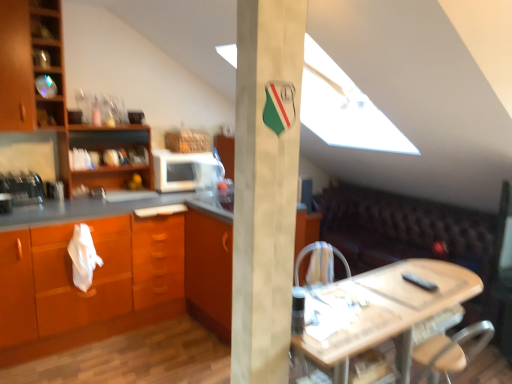
Question: From a real-world perspective, is white fabric armchair at center over metallic silver toaster at left, which is the 2th appliance in back-to-front order?

Choices:
 (A) yes
 (B) no

Answer: (B)

Question: From the image's perspective, is white fabric armchair at center over metallic silver toaster at left, arranged as the 1th appliance when viewed from the front?

Choices:
 (A) no
 (B) yes

Answer: (A)

Question: From the image's perspective, would you say white fabric armchair at center is shown under metallic silver toaster at left, arranged as the 1th appliance when viewed from the front?

Choices:
 (A) yes
 (B) no

Answer: (A)

Question: Is white fabric armchair at center at the left side of metallic silver toaster at left, which is the first appliance from left to right?

Choices:
 (A) no
 (B) yes

Answer: (A)

Question: Does white fabric armchair at center have a lesser height compared to metallic silver toaster at left, which is the 2th appliance in back-to-front order?

Choices:
 (A) no
 (B) yes

Answer: (A)

Question: Is white fabric armchair at center to the right of metallic silver toaster at left, the 2th appliance from the right, from the viewer's perspective?

Choices:
 (A) no
 (B) yes

Answer: (B)

Question: Is white fabric armchair at center bigger than white matte microwave at center, the second appliance from the left?

Choices:
 (A) no
 (B) yes

Answer: (A)

Question: Can you confirm if white fabric armchair at center is thinner than white matte microwave at center, which ranks as the first appliance in back-to-front order?

Choices:
 (A) yes
 (B) no

Answer: (A)

Question: Considering the relative positions of white fabric armchair at center and white matte microwave at center, which ranks as the first appliance in back-to-front order, in the image provided, is white fabric armchair at center to the left of white matte microwave at center, which ranks as the first appliance in back-to-front order, from the viewer's perspective?

Choices:
 (A) no
 (B) yes

Answer: (A)

Question: From the image's perspective, is white fabric armchair at center on white matte microwave at center, the 2th appliance positioned from the front?

Choices:
 (A) no
 (B) yes

Answer: (A)

Question: From the image's perspective, does white fabric armchair at center appear lower than white matte microwave at center, the 2th appliance positioned from the front?

Choices:
 (A) no
 (B) yes

Answer: (B)

Question: Does white fabric armchair at center have a smaller size compared to white matte microwave at center, the 2th appliance positioned from the front?

Choices:
 (A) no
 (B) yes

Answer: (B)

Question: Is orange wood cabinet at left, positioned as the second cabinetry in top-to-bottom order, located within wooden shelves at left?

Choices:
 (A) no
 (B) yes

Answer: (A)